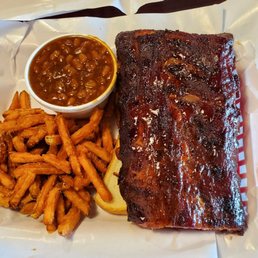
The image size is (258, 258). In order to click on plastic bowl in this screenshot , I will do `click(74, 115)`.